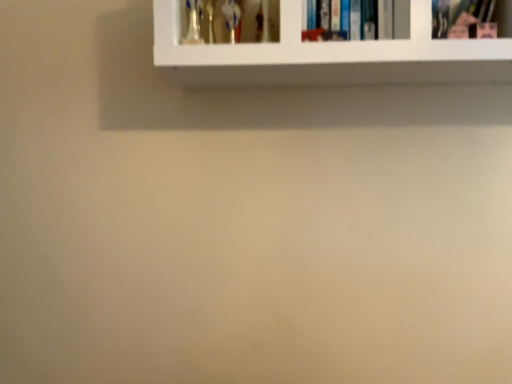
Question: Is white glossy shelf at upper center to the right of hardcover book at upper center, acting as the first book starting from the left, from the viewer's perspective?

Choices:
 (A) yes
 (B) no

Answer: (A)

Question: Can you confirm if white glossy shelf at upper center is smaller than hardcover book at upper center, arranged as the 2th book when viewed from the front?

Choices:
 (A) no
 (B) yes

Answer: (A)

Question: Considering the relative sizes of white glossy shelf at upper center and hardcover book at upper center, acting as the first book starting from the left, in the image provided, is white glossy shelf at upper center taller than hardcover book at upper center, acting as the first book starting from the left,?

Choices:
 (A) yes
 (B) no

Answer: (A)

Question: Does white glossy shelf at upper center come behind hardcover book at upper center, placed as the 2th book when sorted from right to left?

Choices:
 (A) yes
 (B) no

Answer: (B)

Question: Is white glossy shelf at upper center aimed at hardcover book at upper center, arranged as the 2th book when viewed from the front?

Choices:
 (A) yes
 (B) no

Answer: (A)

Question: Is hardcover book at upper center, placed as the 2th book when sorted from right to left, in front of or behind pink matte book at upper right, the second book from the left, in the image?

Choices:
 (A) behind
 (B) front

Answer: (A)

Question: In the image, is hardcover book at upper center, the first book in the back-to-front sequence, on the left side or the right side of pink matte book at upper right, placed as the second book when sorted from back to front?

Choices:
 (A) left
 (B) right

Answer: (A)

Question: Considering the positions of hardcover book at upper center, placed as the 2th book when sorted from right to left, and pink matte book at upper right, the second book from the left, in the image, is hardcover book at upper center, placed as the 2th book when sorted from right to left, taller or shorter than pink matte book at upper right, the second book from the left,?

Choices:
 (A) short
 (B) tall

Answer: (B)

Question: Considering the positions of hardcover book at upper center, placed as the 2th book when sorted from right to left, and pink matte book at upper right, the 1th book in the front-to-back sequence, in the image, is hardcover book at upper center, placed as the 2th book when sorted from right to left, bigger or smaller than pink matte book at upper right, the 1th book in the front-to-back sequence,?

Choices:
 (A) small
 (B) big

Answer: (B)

Question: Looking at their shapes, would you say hardcover book at upper center, the first book in the back-to-front sequence, is wider or thinner than white glossy shelf at upper center?

Choices:
 (A) wide
 (B) thin

Answer: (B)

Question: From the image's perspective, relative to white glossy shelf at upper center, is hardcover book at upper center, the first book in the back-to-front sequence, above or below?

Choices:
 (A) above
 (B) below

Answer: (A)

Question: Is hardcover book at upper center, acting as the first book starting from the left, to the left or to the right of white glossy shelf at upper center in the image?

Choices:
 (A) left
 (B) right

Answer: (A)

Question: Relative to white glossy shelf at upper center, is hardcover book at upper center, placed as the 2th book when sorted from right to left, in front or behind?

Choices:
 (A) front
 (B) behind

Answer: (B)

Question: In the image, is pink matte book at upper right, marked as the 1th book in a right-to-left arrangement, on the left side or the right side of hardcover book at upper center, placed as the 2th book when sorted from right to left?

Choices:
 (A) right
 (B) left

Answer: (A)

Question: Is pink matte book at upper right, marked as the 1th book in a right-to-left arrangement, wider or thinner than hardcover book at upper center, acting as the first book starting from the left?

Choices:
 (A) wide
 (B) thin

Answer: (B)